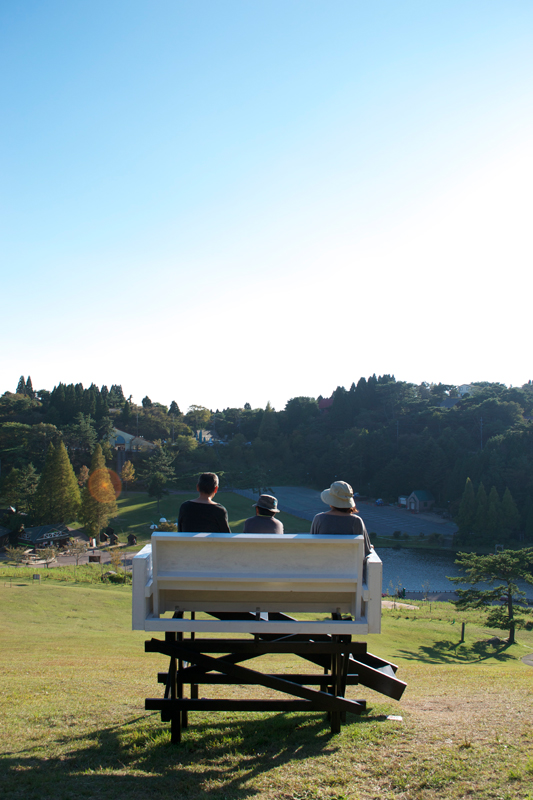
You are a GUI agent. You are given a task and a screenshot of the screen. Output one action in this format:
    pyautogui.click(x=<x>, y=<y>)
    Task: Click on the support for a seat
    This screenshot has height=800, width=533.
    Given the screenshot: What is the action you would take?
    pyautogui.click(x=259, y=678)